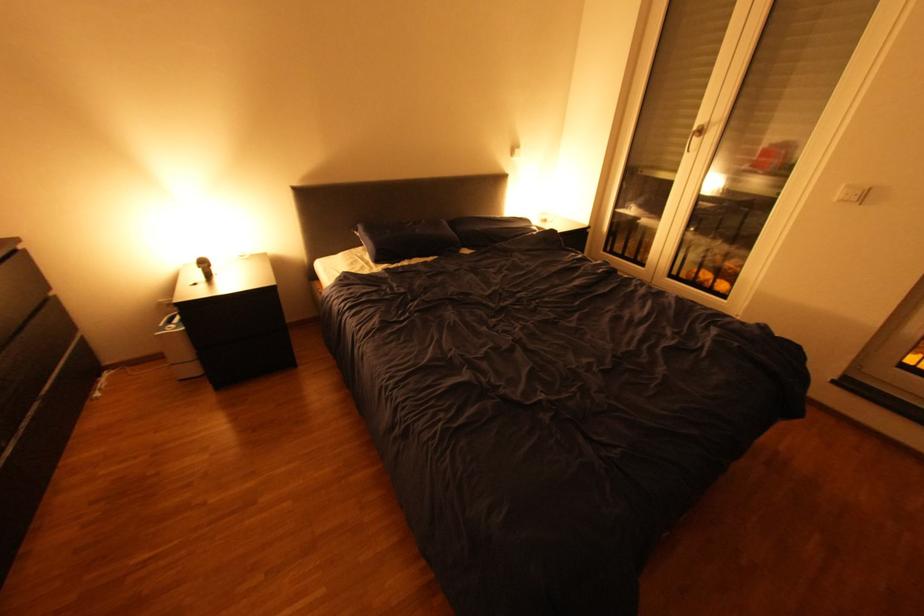
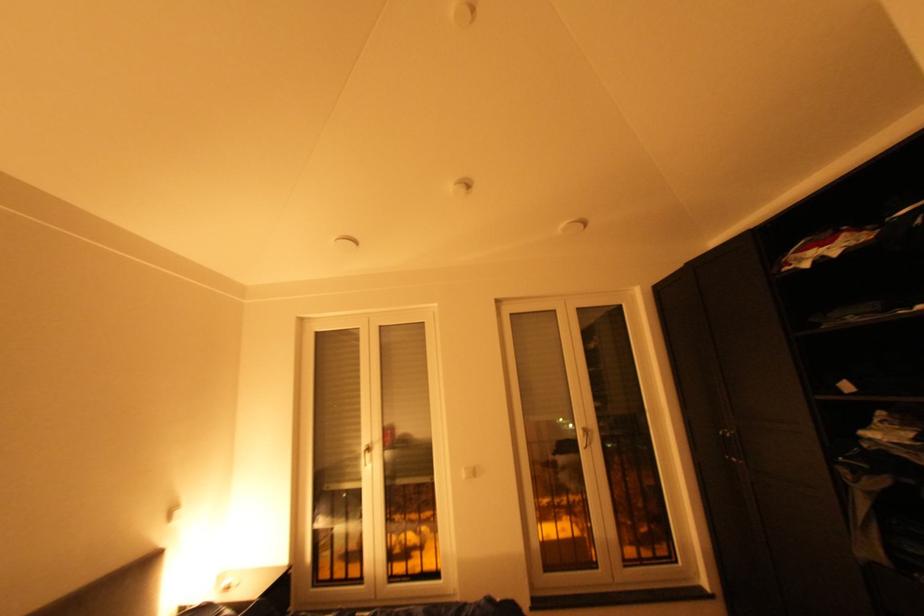
Find the pixel in the second image that matches point 846,195 in the first image.

(473, 476)